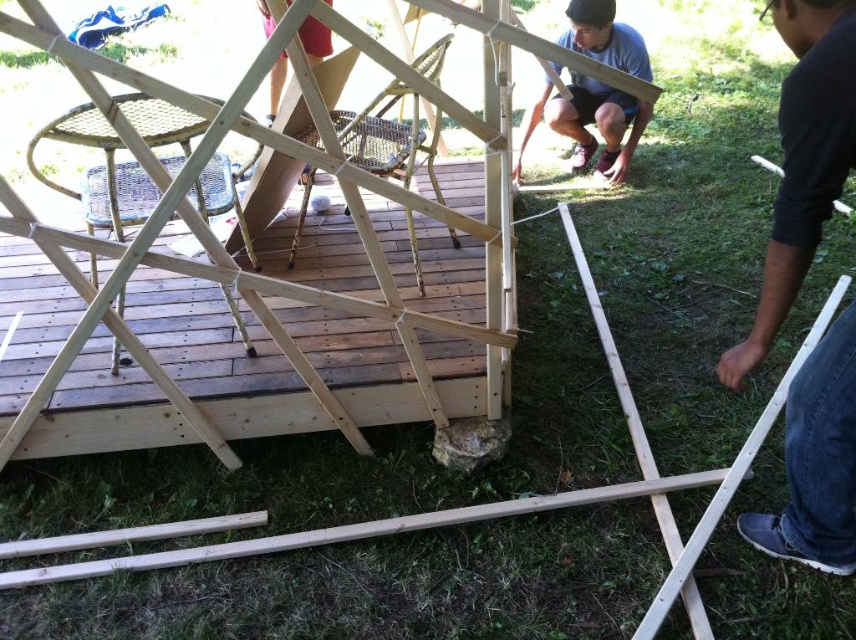
Does point (411, 394) lie behind point (566, 106)?

That is False.

Consider the image. Who is shorter, natural wood deck at center or matte wood person at center?

matte wood person at center is shorter.

Where is `natural wood deck at center`? The height and width of the screenshot is (640, 856). natural wood deck at center is located at coordinates (278, 356).

Locate an element on the screen. natural wood deck at center is located at coordinates (278, 356).

Between dark blue jeans at lower right and matte wood person at center, which one is positioned higher?

matte wood person at center

Which of these two, dark blue jeans at lower right or matte wood person at center, stands shorter?

Standing shorter between the two is matte wood person at center.

At what (x,y) coordinates should I click in order to perform the action: click on dark blue jeans at lower right. Please return your answer as a coordinate pair (x, y). Looking at the image, I should click on (803, 160).

Can you confirm if natural wood deck at center is wider than dark blue jeans at lower right?

Indeed, natural wood deck at center has a greater width compared to dark blue jeans at lower right.

Is natural wood deck at center smaller than dark blue jeans at lower right?

No.

This screenshot has width=856, height=640. In order to click on natural wood deck at center in this screenshot , I will do `click(278, 356)`.